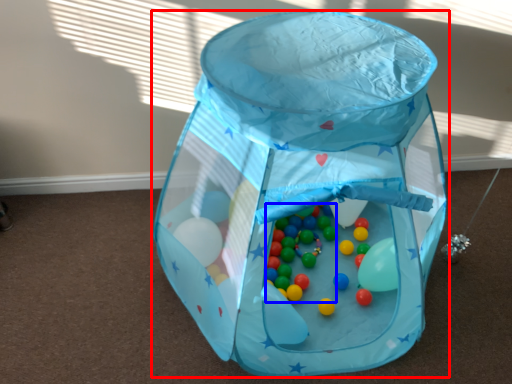
Question: Which object appears farthest to the camera in this image, baby carriage (highlighted by a red box) or toy (highlighted by a blue box)?

Choices:
 (A) baby carriage
 (B) toy

Answer: (B)